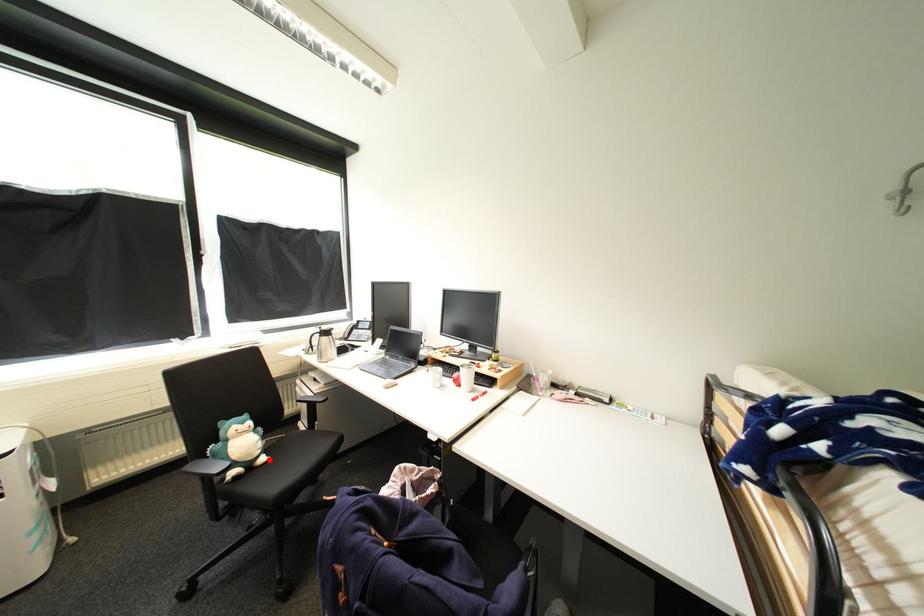
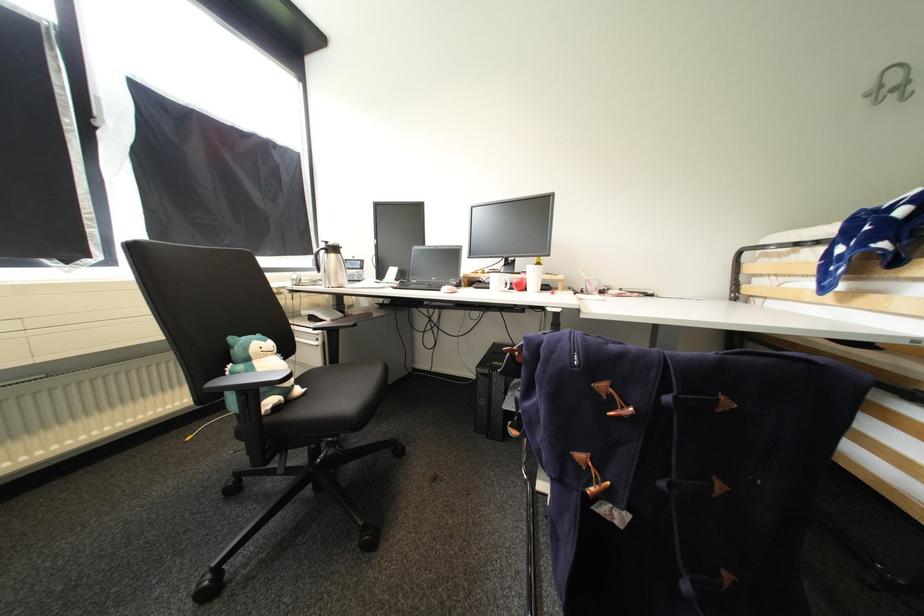
Where in the second image is the point corresponding to the highlighted location from the first image?

(306, 391)